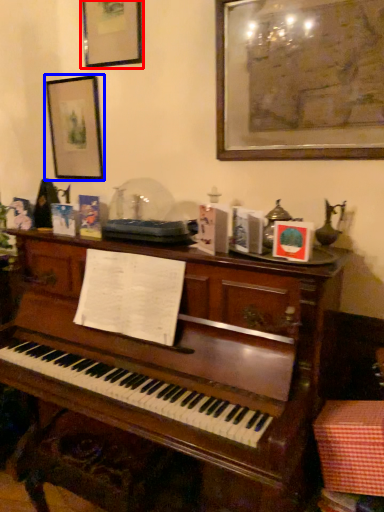
Question: Which object is further to the camera taking this photo, picture frame (highlighted by a red box) or picture frame (highlighted by a blue box)?

Choices:
 (A) picture frame
 (B) picture frame

Answer: (B)